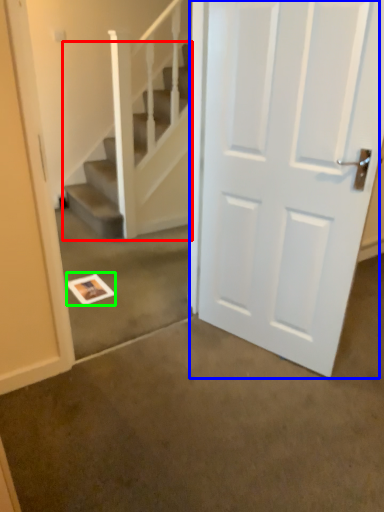
Question: Which object is the farthest from stairs (highlighted by a red box)? Choose among these: door (highlighted by a blue box) or postcard (highlighted by a green box).

Choices:
 (A) door
 (B) postcard

Answer: (A)